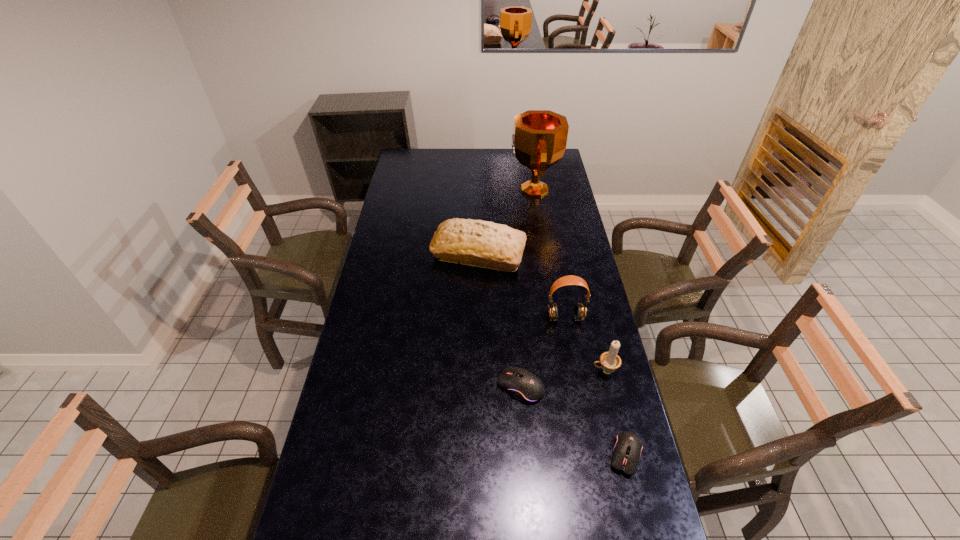
Where is `vacant space at the near right corner of the desktop`? The image size is (960, 540). vacant space at the near right corner of the desktop is located at coordinates (631, 527).

The image size is (960, 540). In order to click on free spot between the candle_holder and the bread in this screenshot , I will do `click(541, 312)`.

I want to click on free spot between the third farthest object and the candle_holder, so click(585, 345).

Where is `free area in between the candle_holder and the fifth nearest object`? The height and width of the screenshot is (540, 960). free area in between the candle_holder and the fifth nearest object is located at coordinates (541, 312).

I want to click on vacant region between the headset and the taller computer mouse, so click(542, 352).

The image size is (960, 540). I want to click on free space between the tallest object and the bread, so pyautogui.click(x=506, y=221).

Identify the location of vacant area that lies between the farther computer mouse and the shortest object. (573, 421).

Where is `unoccupied position between the fourth nearest object and the nearest object`? unoccupied position between the fourth nearest object and the nearest object is located at coordinates (595, 387).

Where is `unoccupied area between the left computer mouse and the candle_holder`? The height and width of the screenshot is (540, 960). unoccupied area between the left computer mouse and the candle_holder is located at coordinates (563, 379).

Identify the location of object that is the fifth closest to the right computer mouse. (539, 138).